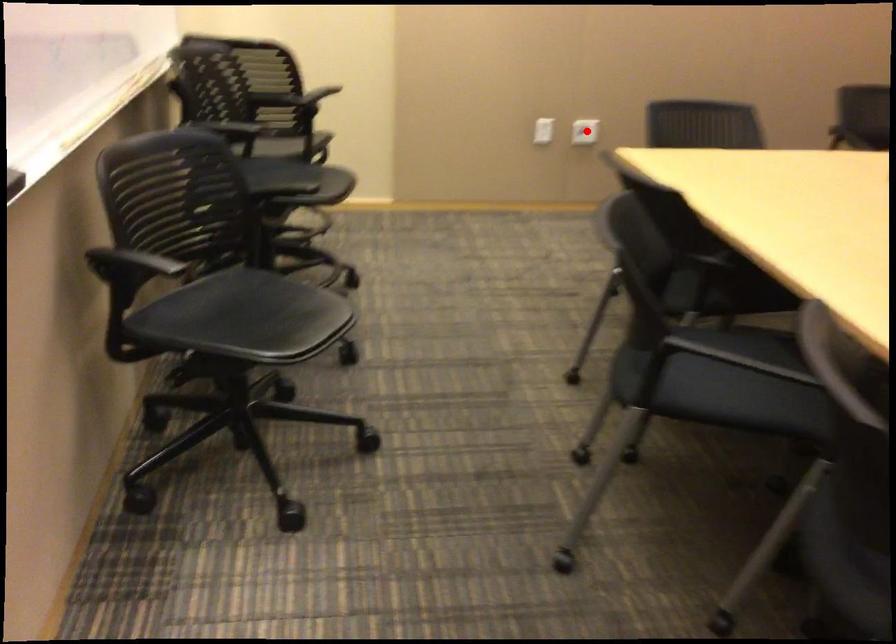
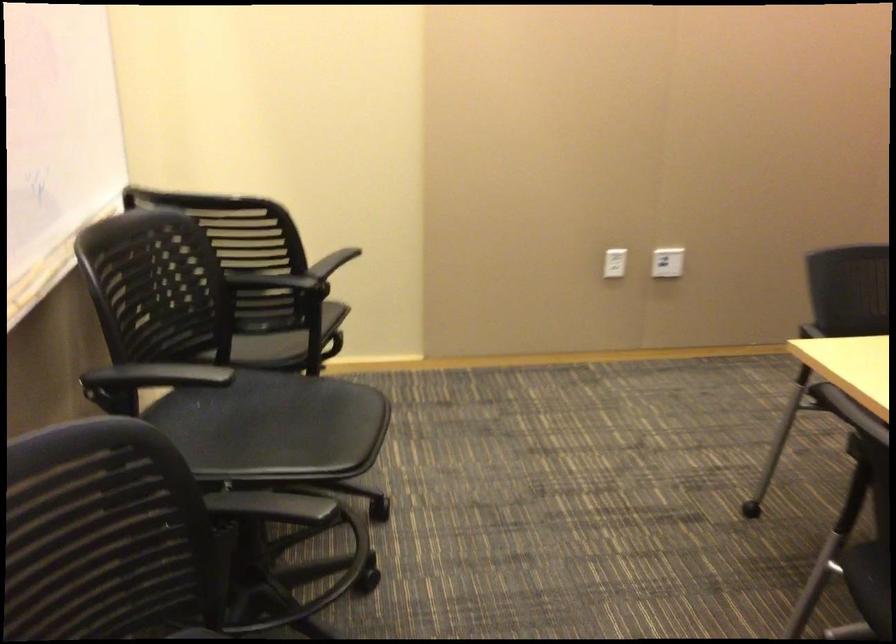
Find the pixel in the second image that matches the highlighted location in the first image.

(667, 261)